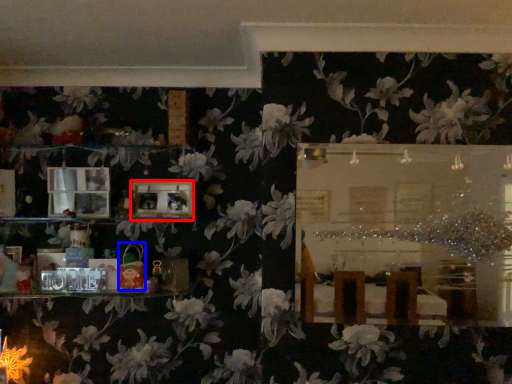
Question: Which object is closer to the camera taking this photo, picture frame (highlighted by a red box) or toy (highlighted by a blue box)?

Choices:
 (A) picture frame
 (B) toy

Answer: (B)